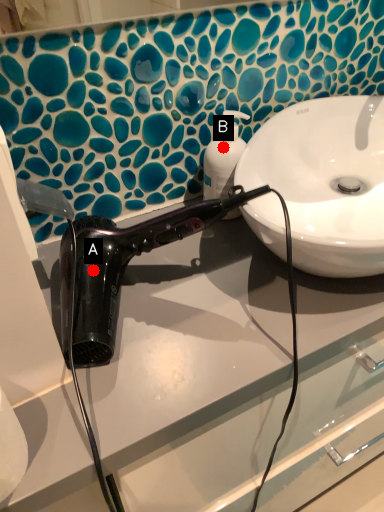
Question: Two points are circled on the image, labeled by A and B beside each circle. Which point is further to the camera?

Choices:
 (A) A is further
 (B) B is further

Answer: (B)